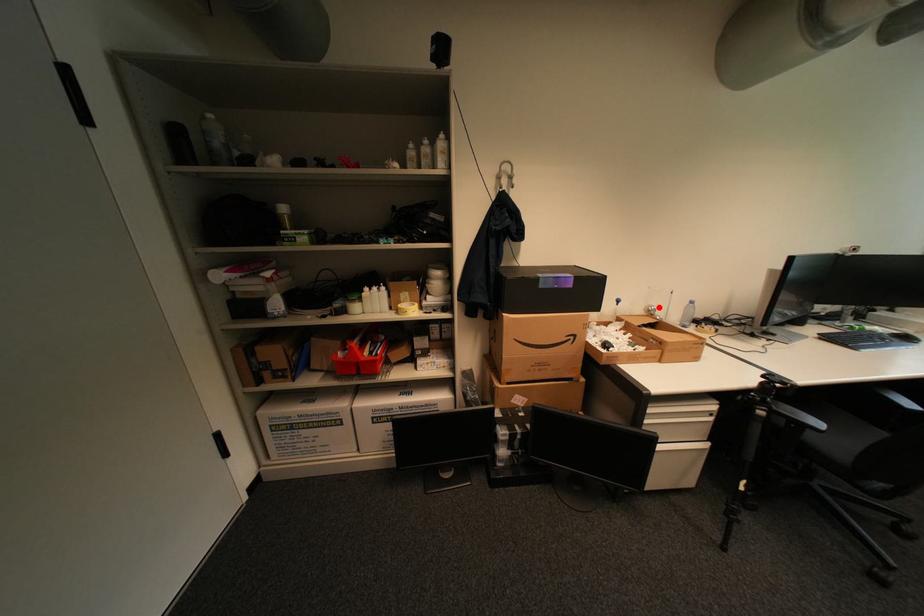
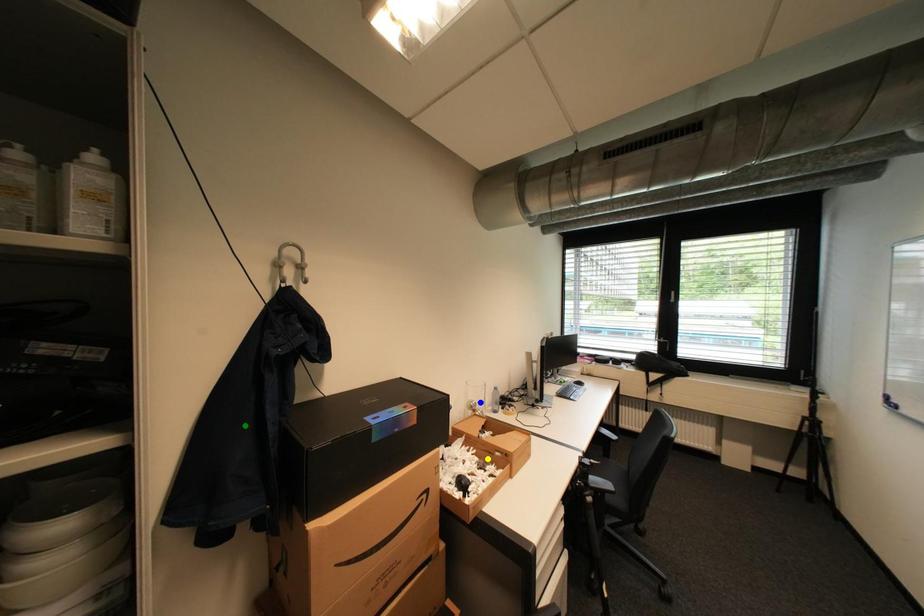
Question: I am providing you with two images of the same scene from different viewpoints. A red point is marked on the first image. You are given multiple points on the second image. Which point in image 2 is actually the same real-world point as the red point in image 1?

Choices:
 (A) yellow point
 (B) green point
 (C) blue point

Answer: (C)